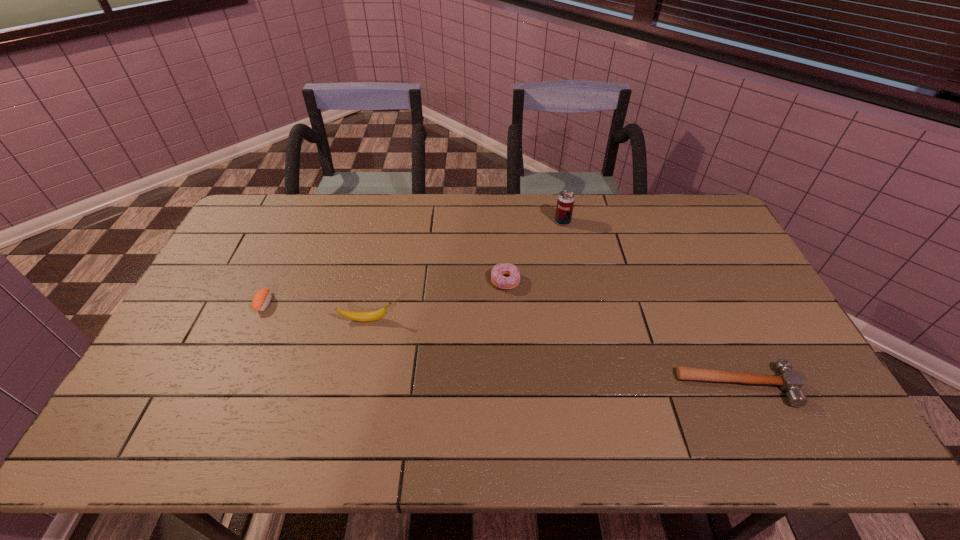
I want to click on the farthest object, so click(565, 203).

Find the location of a particular element. Image resolution: width=960 pixels, height=540 pixels. the tallest object is located at coordinates (565, 203).

The image size is (960, 540). I want to click on the fourth object from right to left, so click(368, 316).

Where is `the second nearest object`? The width and height of the screenshot is (960, 540). the second nearest object is located at coordinates (368, 316).

Image resolution: width=960 pixels, height=540 pixels. I want to click on the third object from right to left, so click(x=497, y=272).

This screenshot has height=540, width=960. I want to click on sushi, so click(x=262, y=298).

Find the location of a particular element. The image size is (960, 540). the rightmost object is located at coordinates (791, 382).

Find the location of a particular element. Image resolution: width=960 pixels, height=540 pixels. the nearest object is located at coordinates (791, 382).

The height and width of the screenshot is (540, 960). I want to click on free space located on the right of the second object from right to left, so click(654, 222).

Locate an element on the screen. The image size is (960, 540). vacant space located at the stem of the second nearest object is located at coordinates (482, 320).